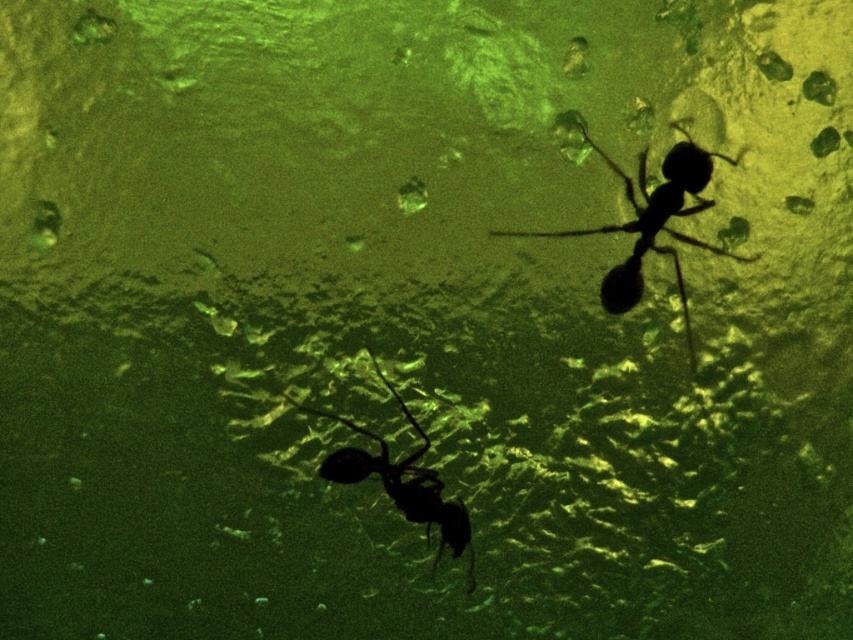
Question: Does black matte ant at upper right appear on the right side of black matte ant at lower center?

Choices:
 (A) no
 (B) yes

Answer: (B)

Question: Where is black matte ant at upper right located in relation to black matte ant at lower center in the image?

Choices:
 (A) below
 (B) above

Answer: (B)

Question: Among these points, which one is nearest to the camera?

Choices:
 (A) (453, 532)
 (B) (561, 230)

Answer: (A)

Question: Is black matte ant at upper right bigger than black matte ant at lower center?

Choices:
 (A) yes
 (B) no

Answer: (A)